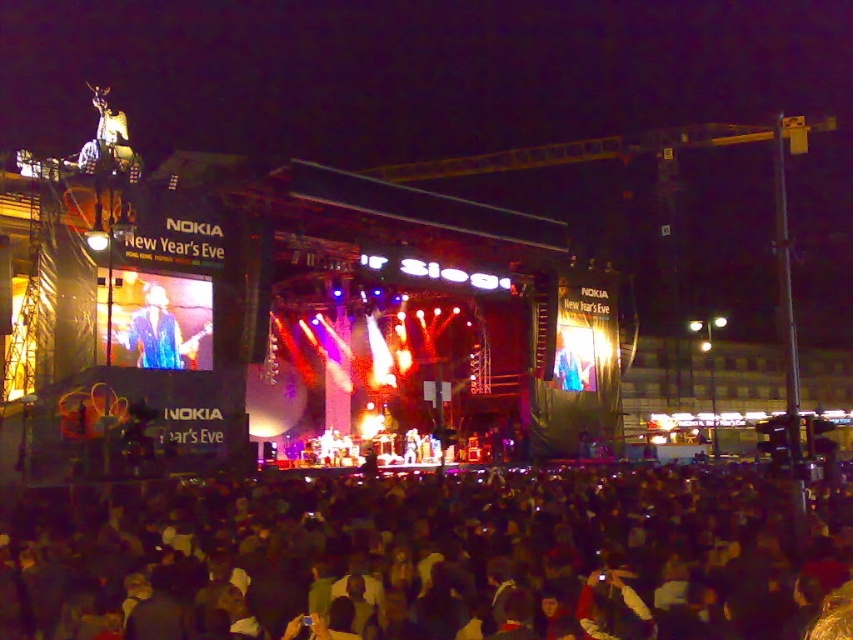
You are a photographer at the New Year celebration. You need to capture a photo that includes both the dark fabric crowd at lower center and the blue denim jacket at upper left. Based on their positions, which object should be placed on the right side of your photo?

The dark fabric crowd at lower center should be placed on the right side of your photo because it is positioned on the right side of the blue denim jacket at upper left according to the description.

You are standing at the front of the stage and want to take a photo of the dark fabric crowd at lower center. Your camera has a maximum focus range of 50 meters. Will you be able to focus on the crowd?

The dark fabric crowd at lower center is 49.95 meters away from the camera. Since the camera can focus up to 50 meters, you can focus on the crowd as the distance is within the range.

Consider the image. You are standing at the center of the stage during the New Year celebration. Looking down, you notice a point marked at coordinates (422, 556). What object or feature is located at this point?

The point at coordinates (422, 556) indicates the location of the dark fabric crowd at lower center.